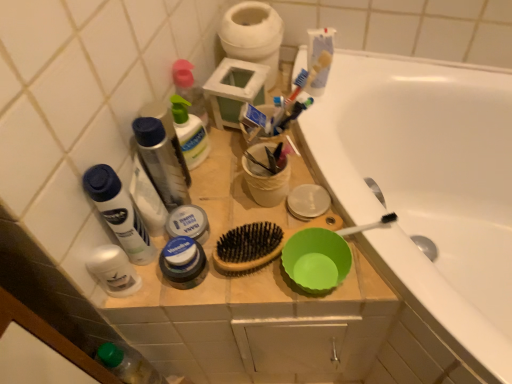
Find the location of a particular element. Image resolution: width=512 pixels, height=384 pixels. vacant space in front of translucent plastic spray bottle at upper center is located at coordinates (216, 209).